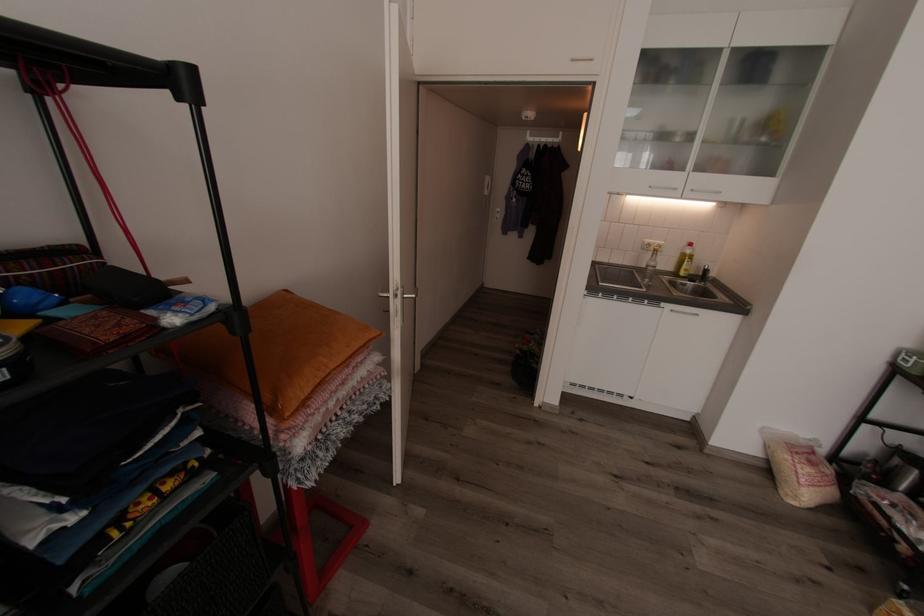
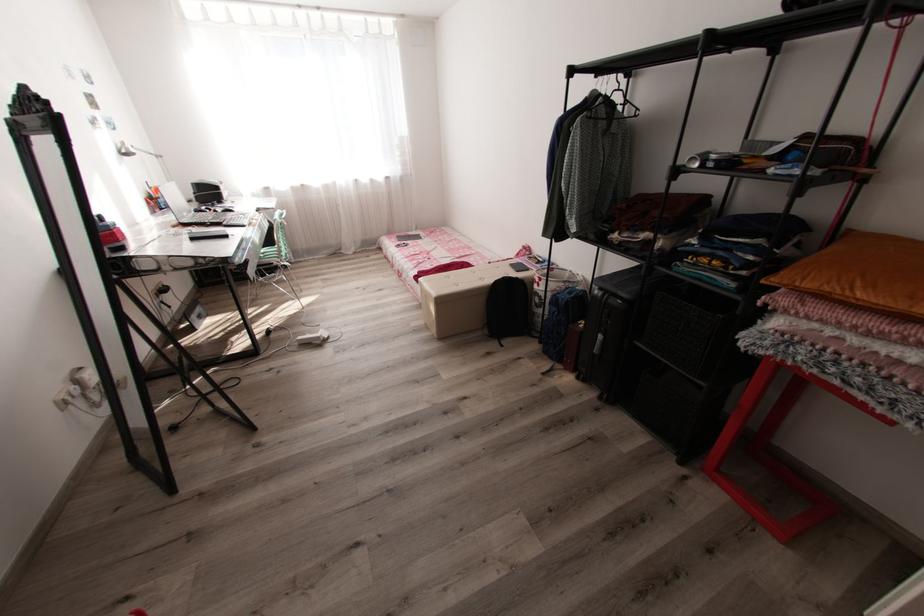
The point at (338, 369) is marked in the first image. Where is the corresponding point in the second image?

(861, 299)